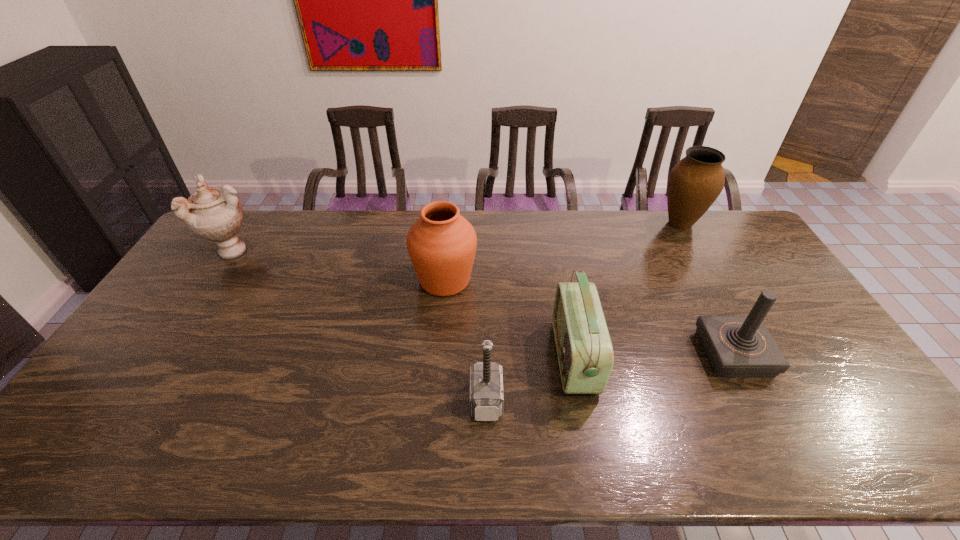
I want to click on free location located on the rectangular base of the joystick, so click(616, 354).

Where is `vacant space located 0.130m on the rectangular base of the joystick`? Image resolution: width=960 pixels, height=540 pixels. vacant space located 0.130m on the rectangular base of the joystick is located at coordinates (656, 354).

You are a GUI agent. You are given a task and a screenshot of the screen. Output one action in this format:
    pyautogui.click(x=<x>, y=<y>)
    Task: Click on the vacant space located on the front panel of the third object from right to left
    The image size is (960, 540).
    Given the screenshot: What is the action you would take?
    pyautogui.click(x=487, y=357)

Where is `free spot located on the front panel of the third object from right to left`? This screenshot has width=960, height=540. free spot located on the front panel of the third object from right to left is located at coordinates (479, 357).

Locate an element on the screen. vacant point located 0.170m on the front panel of the third object from right to left is located at coordinates (493, 357).

This screenshot has width=960, height=540. Identify the location of free spot located for striking with the head of the hammer. (372, 400).

Find the location of a particular element. vacant space located for striking with the head of the hammer is located at coordinates tap(352, 400).

In order to click on blank space located for striking with the head of the hammer in this screenshot , I will do `click(450, 400)`.

I want to click on object located in the left edge section of the desktop, so click(x=214, y=214).

The image size is (960, 540). I want to click on object at the right edge, so click(695, 182).